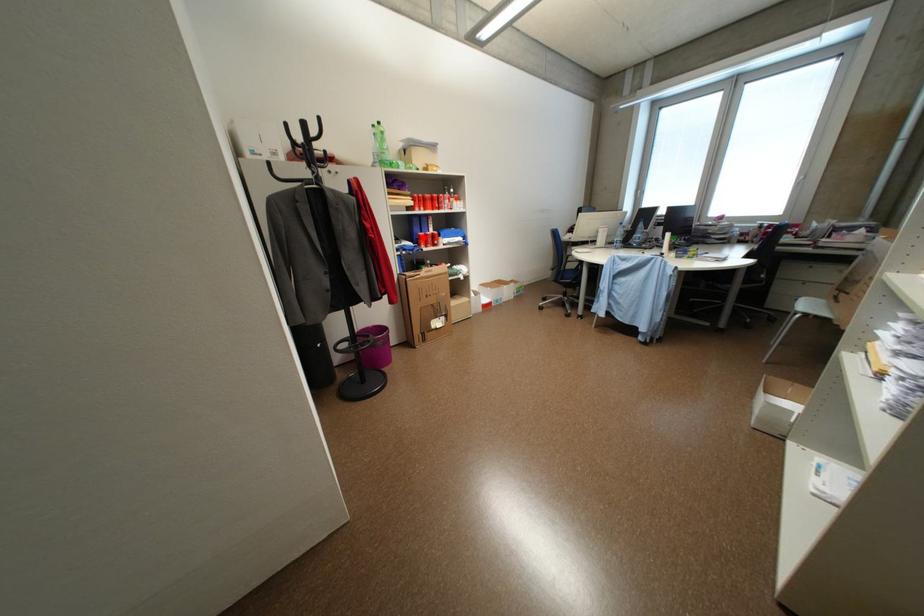
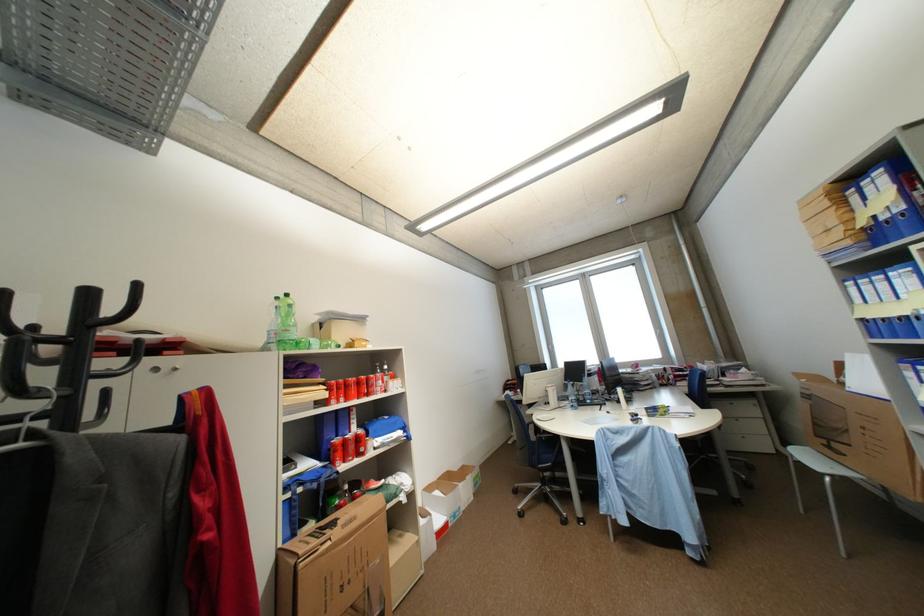
Question: I am providing you with two images of the same scene from different viewpoints. In image1, a red point is highlighted. Considering the same 3D point in image2, which of the following is correct?

Choices:
 (A) It is closer
 (B) It is farther

Answer: (B)